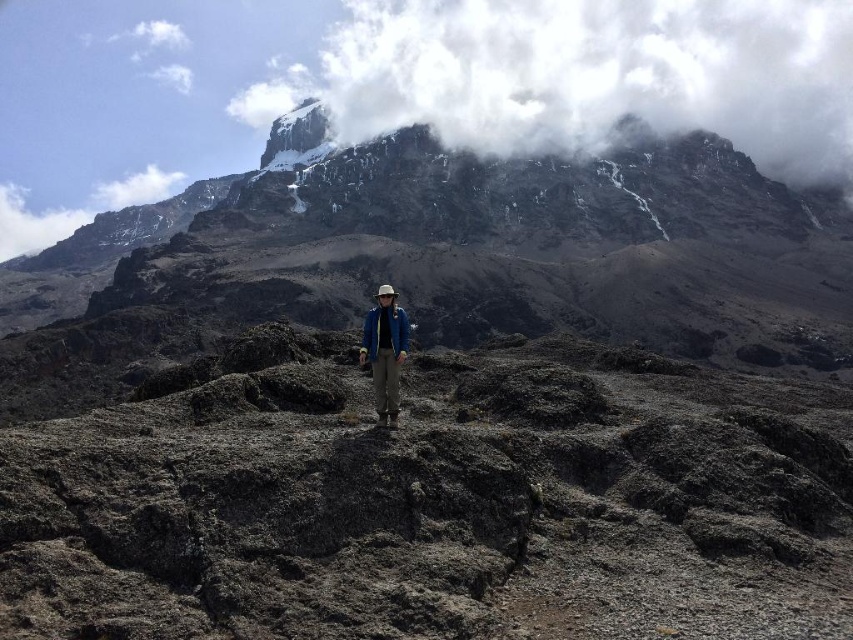
Is white fluffy cloud at upper center wider than matte blue jacket at center?

Yes, white fluffy cloud at upper center is wider than matte blue jacket at center.

Between point (387, 28) and point (372, 310), which one is positioned behind?

Positioned behind is point (387, 28).

The height and width of the screenshot is (640, 853). I want to click on white fluffy cloud at upper center, so pyautogui.click(x=589, y=76).

Which is more to the right, rugged rock mountain at center or white fluffy cloud at upper center?

From the viewer's perspective, white fluffy cloud at upper center appears more on the right side.

Does rugged rock mountain at center appear under white fluffy cloud at upper center?

Yes, rugged rock mountain at center is below white fluffy cloud at upper center.

Is point (688, 250) positioned in front of point (793, 170)?

Yes, point (688, 250) is closer to viewer.

You are a GUI agent. You are given a task and a screenshot of the screen. Output one action in this format:
    pyautogui.click(x=<x>, y=<y>)
    Task: Click on the rugged rock mountain at center
    This screenshot has width=853, height=640.
    Given the screenshot: What is the action you would take?
    pyautogui.click(x=480, y=243)

What do you see at coordinates (433, 500) in the screenshot? I see `dark gray rock at center` at bounding box center [433, 500].

Measure the distance from dark gray rock at center to rugged rock mountain at center.

A distance of 117.64 meters exists between dark gray rock at center and rugged rock mountain at center.

You are a GUI agent. You are given a task and a screenshot of the screen. Output one action in this format:
    pyautogui.click(x=<x>, y=<y>)
    Task: Click on the dark gray rock at center
    The height and width of the screenshot is (640, 853).
    Given the screenshot: What is the action you would take?
    pyautogui.click(x=433, y=500)